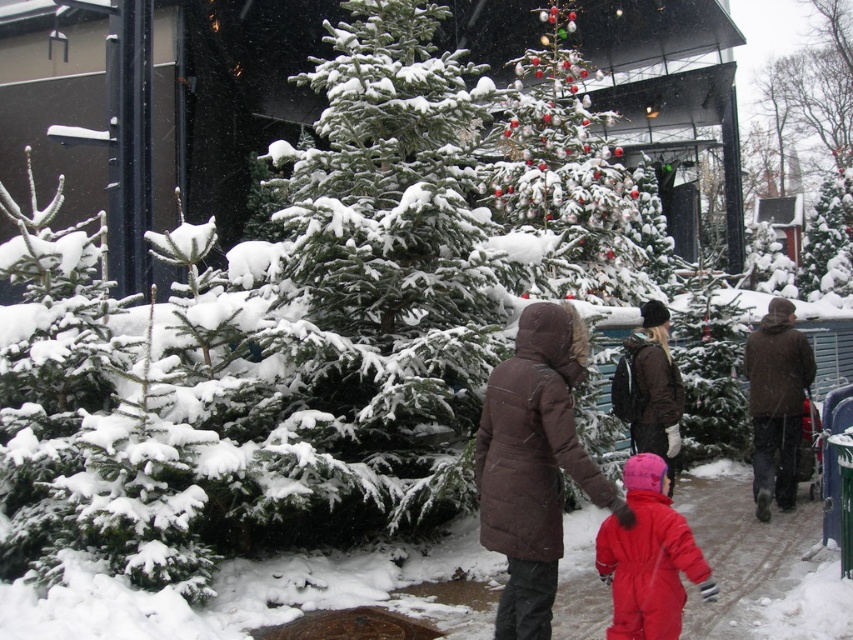
How distant is brown puffy coat at center from dark brown puffer coat at center?

brown puffy coat at center and dark brown puffer coat at center are 3.11 meters apart.

Who is shorter, brown puffy coat at center or dark brown puffer coat at center?

dark brown puffer coat at center

Between point (607, 502) and point (643, 304), which one is positioned behind?

The point (643, 304) is behind.

Identify the location of brown puffy coat at center. (534, 465).

Can you confirm if brown woolen jacket at center-right is smaller than dark brown puffer coat at center?

Actually, brown woolen jacket at center-right might be larger than dark brown puffer coat at center.

How far apart are brown woolen jacket at center-right and dark brown puffer coat at center?

brown woolen jacket at center-right is 1.74 meters from dark brown puffer coat at center.

The width and height of the screenshot is (853, 640). I want to click on brown woolen jacket at center-right, so click(x=776, y=403).

Which is behind, point (561, 465) or point (642, 477)?

Positioned behind is point (642, 477).

Is brown puffy coat at center taller than red snowsuit at center?

Yes.

Between point (555, 556) and point (627, 477), which one is positioned behind?

The point (627, 477) is more distant.

Identify the location of brown puffy coat at center. (534, 465).